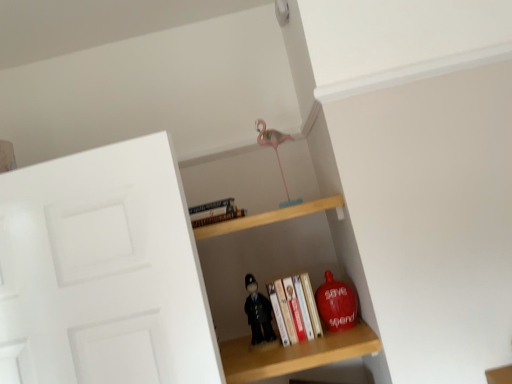
Question: Should I look upward or downward to see matte red piggy bank at lower right, marked as the second toy in a bottom-to-top arrangement?

Choices:
 (A) up
 (B) down

Answer: (B)

Question: From the image's perspective, is wooden shelf at center, acting as the 1th shelf starting from the bottom, located beneath pink plastic flamingo at upper center, marked as the third toy in a bottom-to-top arrangement?

Choices:
 (A) no
 (B) yes

Answer: (B)

Question: Does wooden shelf at center, which is the 2th shelf from top to bottom, have a lesser width compared to pink plastic flamingo at upper center, marked as the third toy in a bottom-to-top arrangement?

Choices:
 (A) yes
 (B) no

Answer: (B)

Question: Is wooden shelf at center, acting as the 1th shelf starting from the bottom, touching pink plastic flamingo at upper center, placed as the second toy when sorted from right to left?

Choices:
 (A) yes
 (B) no

Answer: (B)

Question: From a real-world perspective, does wooden shelf at center, acting as the 1th shelf starting from the bottom, sit lower than pink plastic flamingo at upper center, marked as the third toy in a bottom-to-top arrangement?

Choices:
 (A) yes
 (B) no

Answer: (A)

Question: From a real-world perspective, is wooden shelf at center, acting as the 1th shelf starting from the bottom, on top of pink plastic flamingo at upper center, placed as the 1th toy when sorted from top to bottom?

Choices:
 (A) yes
 (B) no

Answer: (B)

Question: Is wooden shelf at center, which is the 2th shelf from top to bottom, taller than pink plastic flamingo at upper center, placed as the 1th toy when sorted from top to bottom?

Choices:
 (A) no
 (B) yes

Answer: (B)

Question: Does wooden shelf at center, acting as the 1th shelf starting from the bottom, have a greater width compared to wooden shelf at upper center, which is the 1th shelf in top-to-bottom order?

Choices:
 (A) yes
 (B) no

Answer: (A)

Question: Is wooden shelf at center, acting as the 1th shelf starting from the bottom, taller than wooden shelf at upper center, which is the 1th shelf in top-to-bottom order?

Choices:
 (A) no
 (B) yes

Answer: (B)

Question: From a real-world perspective, is wooden shelf at center, which is the 2th shelf from top to bottom, positioned over wooden shelf at upper center, which is the 1th shelf in top-to-bottom order, based on gravity?

Choices:
 (A) yes
 (B) no

Answer: (B)

Question: Does wooden shelf at center, acting as the 1th shelf starting from the bottom, have a larger size compared to wooden shelf at upper center, placed as the 2th shelf when sorted from bottom to top?

Choices:
 (A) no
 (B) yes

Answer: (B)

Question: Is wooden shelf at center, acting as the 1th shelf starting from the bottom, to the right of wooden shelf at upper center, which is the 1th shelf in top-to-bottom order, from the viewer's perspective?

Choices:
 (A) no
 (B) yes

Answer: (B)

Question: Is wooden shelf at center, which is the 2th shelf from top to bottom, not close to wooden shelf at upper center, placed as the 2th shelf when sorted from bottom to top?

Choices:
 (A) yes
 (B) no

Answer: (B)

Question: Considering the relative sizes of wooden shelf at center, which is the 2th shelf from top to bottom, and matte red piggy bank at lower right, marked as the second toy in a bottom-to-top arrangement, in the image provided, is wooden shelf at center, which is the 2th shelf from top to bottom, bigger than matte red piggy bank at lower right, marked as the second toy in a bottom-to-top arrangement,?

Choices:
 (A) no
 (B) yes

Answer: (B)